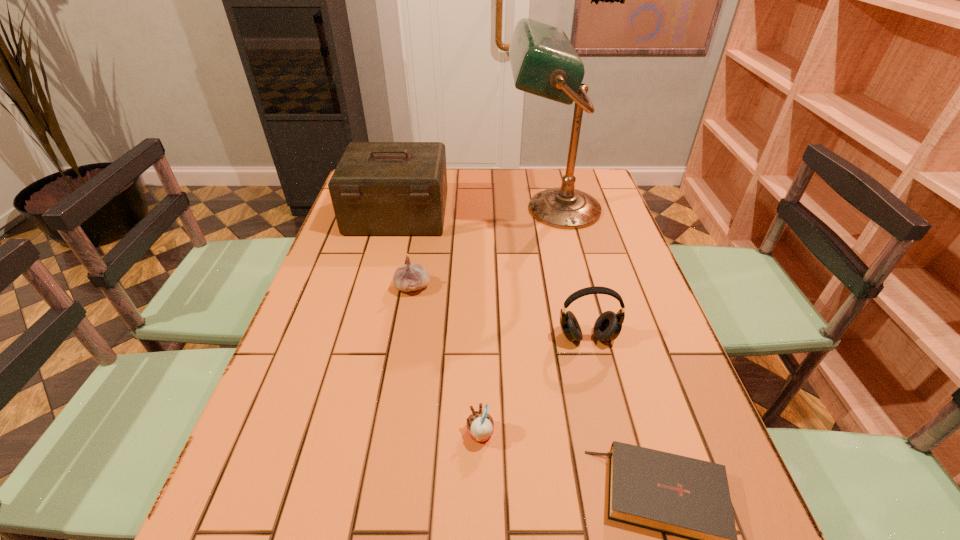
This screenshot has width=960, height=540. In order to click on empty space that is in between the fourth nearest object and the third object from left to right in this screenshot , I will do `click(446, 360)`.

Locate an element on the screen. The image size is (960, 540). free space between the headset and the garlic is located at coordinates (500, 312).

This screenshot has width=960, height=540. I want to click on unoccupied position between the headset and the table lamp, so click(x=570, y=273).

Locate which object ranks in proximity to the tallest object. Please provide its 2D coordinates. Your answer should be formatted as a tuple, i.e. [(x, y)], where the tuple contains the x and y coordinates of a point satisfying the conditions above.

[(378, 188)]

Find the location of `object identified as the second closest to the garlic`. object identified as the second closest to the garlic is located at coordinates (544, 62).

Locate an element on the screen. vacant position in the image that satisfies the following two spatial constraints: 1. on the ear cups of the headset; 2. on the front-facing side of the muffin is located at coordinates (611, 434).

Find the location of a particular element. This screenshot has height=540, width=960. vacant point that satisfies the following two spatial constraints: 1. on the ear cups of the fourth shortest object; 2. on the front-facing side of the second nearest object is located at coordinates (611, 434).